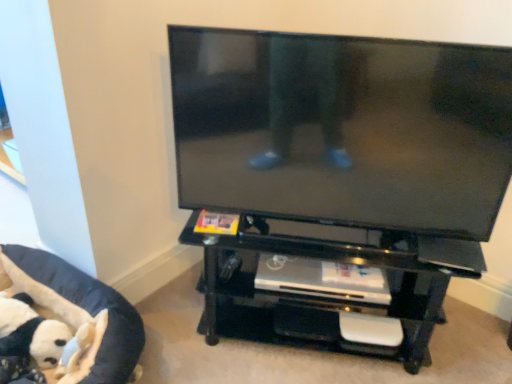
Locate an element on the screen. The width and height of the screenshot is (512, 384). black fabric pet bed at lower left is located at coordinates (81, 312).

At what (x,y) coordinates should I click in order to perform the action: click on black fabric pet bed at lower left. Please return your answer as a coordinate pair (x, y). This screenshot has height=384, width=512. Looking at the image, I should click on (81, 312).

Which is correct: black glossy flat-screen tv at center is inside black glossy entertainment center at center, or outside of it?

black glossy flat-screen tv at center is not inside black glossy entertainment center at center, it's outside.

From a real-world perspective, is black glossy flat-screen tv at center physically located above or below black glossy entertainment center at center?

From a real-world perspective, black glossy flat-screen tv at center is physically above black glossy entertainment center at center.

From the image's perspective, would you say black glossy flat-screen tv at center is shown under black glossy entertainment center at center?

Actually, black glossy flat-screen tv at center appears above black glossy entertainment center at center in the image.

The image size is (512, 384). I want to click on entertainment center that is behind the black glossy flat-screen tv at center, so click(x=315, y=293).

Is black fabric pet bed at lower left to the left or to the right of black glossy entertainment center at center in the image?

Clearly, black fabric pet bed at lower left is on the left of black glossy entertainment center at center in the image.

I want to click on furniture that appears on the left of black glossy entertainment center at center, so click(81, 312).

Would you say black fabric pet bed at lower left is outside black glossy entertainment center at center?

Yes, black fabric pet bed at lower left is outside of black glossy entertainment center at center.

Can you tell me how much black fabric pet bed at lower left and black glossy entertainment center at center differ in facing direction?

black fabric pet bed at lower left and black glossy entertainment center at center are facing 23.1 degrees away from each other.

Between black glossy entertainment center at center and black glossy flat-screen tv at center, which one has larger width?

black glossy entertainment center at center.

Which object is closer to the camera taking this photo, black glossy entertainment center at center or black glossy flat-screen tv at center?

black glossy flat-screen tv at center is in front.

Can you see black glossy entertainment center at center touching black glossy flat-screen tv at center?

No, black glossy entertainment center at center is not making contact with black glossy flat-screen tv at center.

Looking at this image, can you confirm if black glossy entertainment center at center is smaller than black glossy flat-screen tv at center?

No.

From the image's perspective, between black glossy entertainment center at center and black fabric pet bed at lower left, which one is located above?

From the image's view, black glossy entertainment center at center is above.

Based on their positions, is black glossy entertainment center at center located to the left or right of black fabric pet bed at lower left?

Based on their positions, black glossy entertainment center at center is located to the right of black fabric pet bed at lower left.

Considering the sizes of black glossy entertainment center at center and black fabric pet bed at lower left in the image, is black glossy entertainment center at center taller or shorter than black fabric pet bed at lower left?

Clearly, black glossy entertainment center at center is taller compared to black fabric pet bed at lower left.

Are black fabric pet bed at lower left and black glossy flat-screen tv at center beside each other?

No, black fabric pet bed at lower left is not making contact with black glossy flat-screen tv at center.

Consider the image. What's the angular difference between black fabric pet bed at lower left and black glossy flat-screen tv at center's facing directions?

black fabric pet bed at lower left and black glossy flat-screen tv at center are facing 23.1 degrees away from each other.

Which of these two, black fabric pet bed at lower left or black glossy flat-screen tv at center, stands shorter?

Standing shorter between the two is black fabric pet bed at lower left.

Can you confirm if black fabric pet bed at lower left is wider than black glossy flat-screen tv at center?

Yes.

Would you say black glossy flat-screen tv at center is a long distance from black fabric pet bed at lower left?

black glossy flat-screen tv at center is actually quite close to black fabric pet bed at lower left.

Between black glossy flat-screen tv at center and black fabric pet bed at lower left, which one has smaller size?

With smaller size is black fabric pet bed at lower left.

Which of these two, black glossy flat-screen tv at center or black fabric pet bed at lower left, stands taller?

Standing taller between the two is black glossy flat-screen tv at center.

Find the location of `television in front of the black glossy entertainment center at center`. television in front of the black glossy entertainment center at center is located at coordinates (343, 128).

At what (x,y) coordinates should I click in order to perform the action: click on entertainment center that appears above the black fabric pet bed at lower left (from the image's perspective). Please return your answer as a coordinate pair (x, y). Looking at the image, I should click on (315, 293).

From the picture: Considering their positions, is black glossy entertainment center at center positioned further to black fabric pet bed at lower left than black glossy flat-screen tv at center?

Among the two, black glossy flat-screen tv at center is located further to black fabric pet bed at lower left.

From the image, which object appears to be nearer to black glossy flat-screen tv at center, black fabric pet bed at lower left or black glossy entertainment center at center?

Among the two, black glossy entertainment center at center is located nearer to black glossy flat-screen tv at center.

Based on their spatial positions, is black fabric pet bed at lower left or black glossy flat-screen tv at center further from black glossy entertainment center at center?

black fabric pet bed at lower left.

When comparing their distances from black glossy flat-screen tv at center, does black glossy entertainment center at center or black fabric pet bed at lower left seem closer?

Based on the image, black glossy entertainment center at center appears to be nearer to black glossy flat-screen tv at center.

Considering their positions, is black glossy flat-screen tv at center positioned further to black glossy entertainment center at center than black fabric pet bed at lower left?

Based on the image, black fabric pet bed at lower left appears to be further to black glossy entertainment center at center.

Looking at the image, which one is located further to black fabric pet bed at lower left, black glossy flat-screen tv at center or black glossy entertainment center at center?

black glossy flat-screen tv at center.

In order to click on television between black fabric pet bed at lower left and black glossy entertainment center at center in the horizontal direction in this screenshot , I will do `click(343, 128)`.